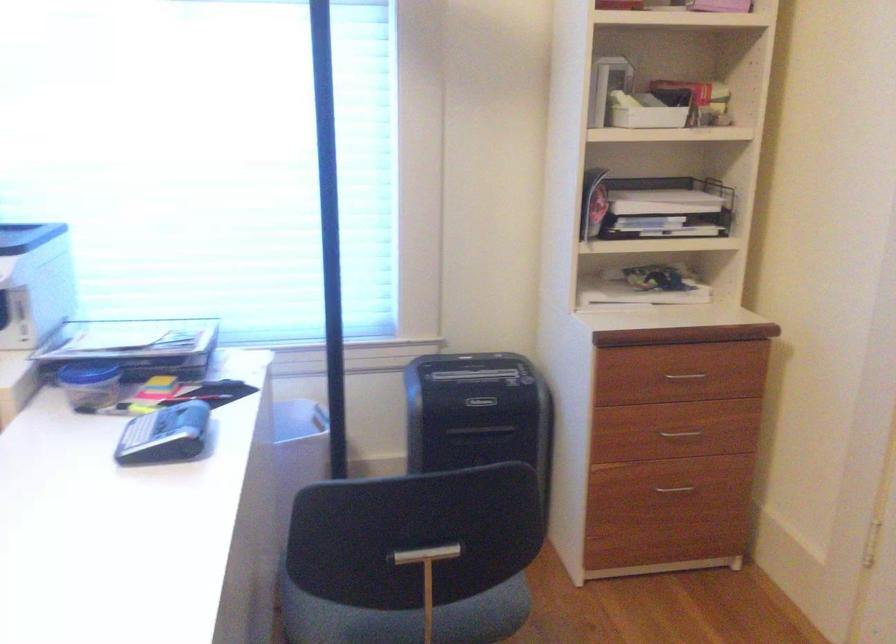
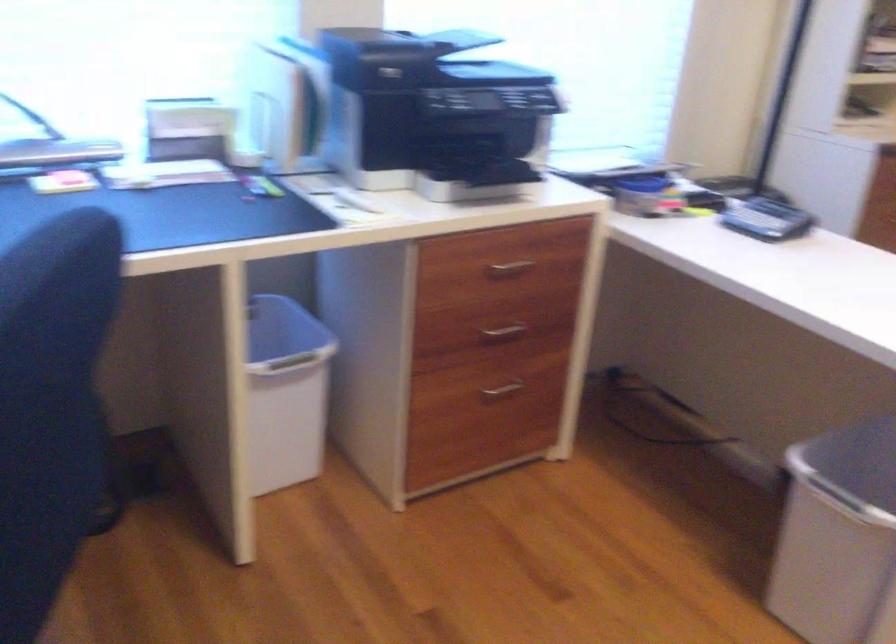
In the second image, find the point that corresponds to point (167, 427) in the first image.

(767, 220)